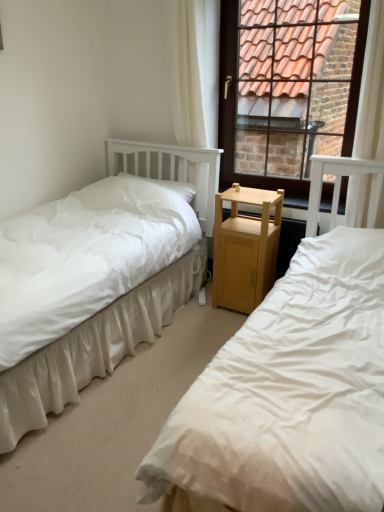
Question: From the image's perspective, would you say brown wooden window at upper right is shown under white fabric bed at left, which is the 2th bed in left-to-right order?

Choices:
 (A) no
 (B) yes

Answer: (A)

Question: From a real-world perspective, is brown wooden window at upper right over white fabric bed at left, which is counted as the first bed, starting from the right?

Choices:
 (A) no
 (B) yes

Answer: (B)

Question: Can you confirm if brown wooden window at upper right is taller than white fabric bed at left, which is counted as the first bed, starting from the right?

Choices:
 (A) yes
 (B) no

Answer: (A)

Question: Is brown wooden window at upper right aimed at white fabric bed at left, which is counted as the first bed, starting from the right?

Choices:
 (A) yes
 (B) no

Answer: (A)

Question: Is brown wooden window at upper right positioned with its back to white fabric bed at left, which is counted as the first bed, starting from the right?

Choices:
 (A) yes
 (B) no

Answer: (B)

Question: Is white fabric bed at left, which is counted as the first bed, starting from the right, inside brown wooden window at upper right?

Choices:
 (A) yes
 (B) no

Answer: (B)

Question: Is white soft pillow at center further to camera compared to white fabric bed at left, which is counted as the first bed, starting from the right?

Choices:
 (A) no
 (B) yes

Answer: (B)

Question: Does white soft pillow at center have a greater width compared to white fabric bed at left, which is the 2th bed in left-to-right order?

Choices:
 (A) no
 (B) yes

Answer: (A)

Question: Is white soft pillow at center smaller than white fabric bed at left, which is the 2th bed in left-to-right order?

Choices:
 (A) no
 (B) yes

Answer: (B)

Question: Is white soft pillow at center closer to the viewer compared to white fabric bed at left, which is counted as the first bed, starting from the right?

Choices:
 (A) no
 (B) yes

Answer: (A)

Question: Does white soft pillow at center have a larger size compared to white fabric bed at left, which is counted as the first bed, starting from the right?

Choices:
 (A) no
 (B) yes

Answer: (A)

Question: From a real-world perspective, is white soft pillow at center positioned over white fabric bed at left, which is the 2th bed in left-to-right order, based on gravity?

Choices:
 (A) yes
 (B) no

Answer: (A)

Question: Is the position of white sheer curtain at upper right, positioned as the second curtain in left-to-right order, more distant than that of light brown wood nightstand at center?

Choices:
 (A) no
 (B) yes

Answer: (A)